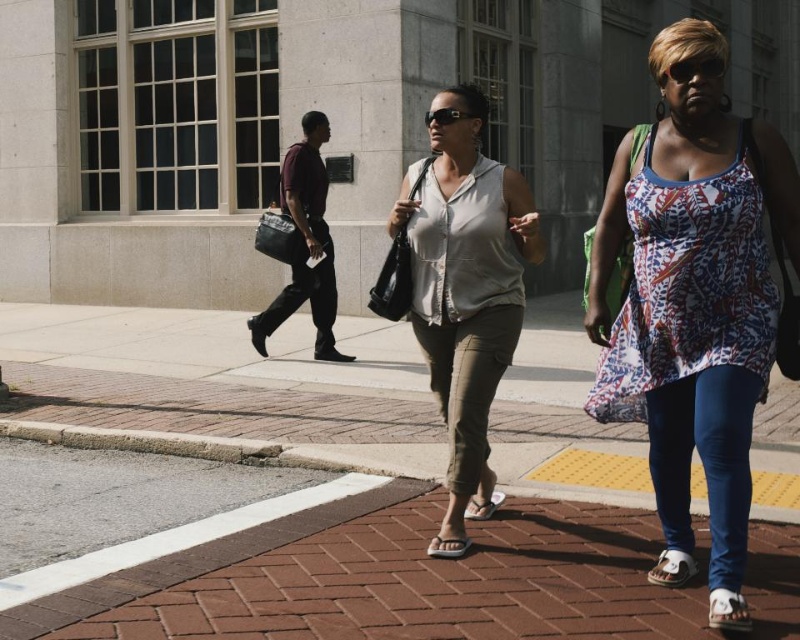
You are a fashion designer observing two women on a crosswalk. You notice the printed fabric tank top at center and the matte gray shirt at center. Which clothing item has a bigger size?

The printed fabric tank top at center has a larger size compared to the matte gray shirt at center.